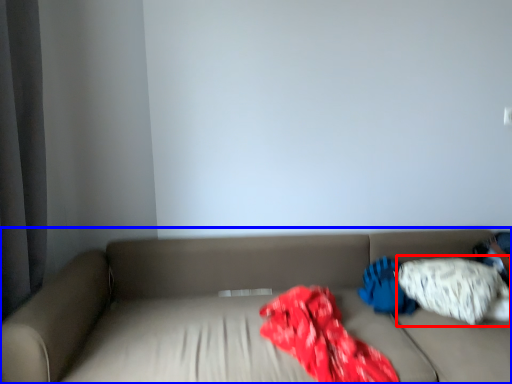
Question: Which of the following is the closest to the observer, pillow (highlighted by a red box) or studio couch (highlighted by a blue box)?

Choices:
 (A) pillow
 (B) studio couch

Answer: (B)